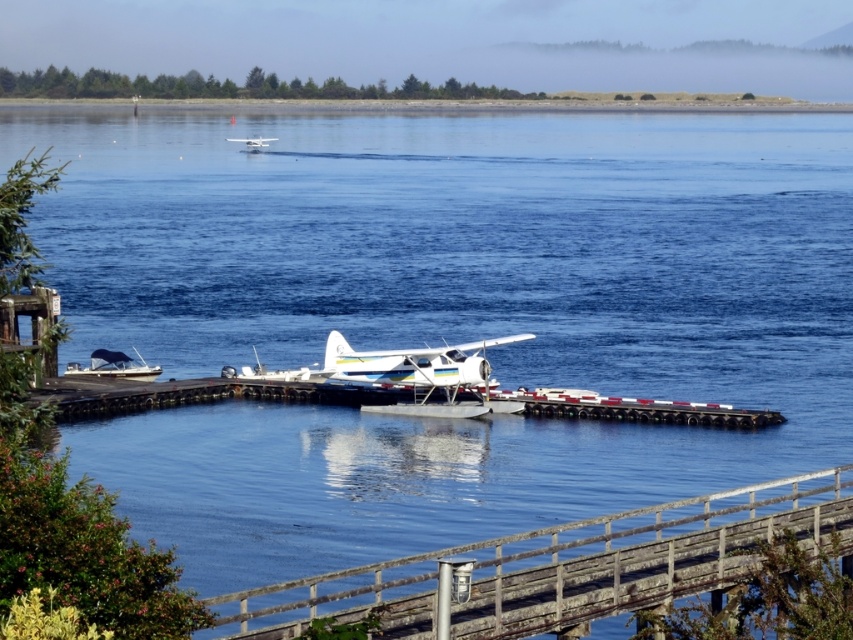
Does point (248, 609) come farther from viewer compared to point (135, 362)?

No.

Between point (532, 548) and point (148, 365), which one is positioned in front?

Point (532, 548) is more forward.

You are a GUI agent. You are given a task and a screenshot of the screen. Output one action in this format:
    pyautogui.click(x=<x>, y=<y>)
    Task: Click on the wooden at lower center
    This screenshot has height=640, width=853.
    Given the screenshot: What is the action you would take?
    pyautogui.click(x=560, y=566)

Who is more forward, (675, 420) or (264, 371)?

Point (675, 420) is more forward.

Which is behind, point (129, 410) or point (485, 358)?

Positioned behind is point (129, 410).

The height and width of the screenshot is (640, 853). What are the coordinates of `white wood dock at center` in the screenshot? It's located at (195, 394).

Does point (483, 344) come in front of point (88, 368)?

Yes, point (483, 344) is in front of point (88, 368).

Who is more distant from viewer, (372, 381) or (125, 376)?

The point (125, 376) is behind.

Locate an element on the screen. This screenshot has width=853, height=640. white matte seaplane at center is located at coordinates (392, 365).